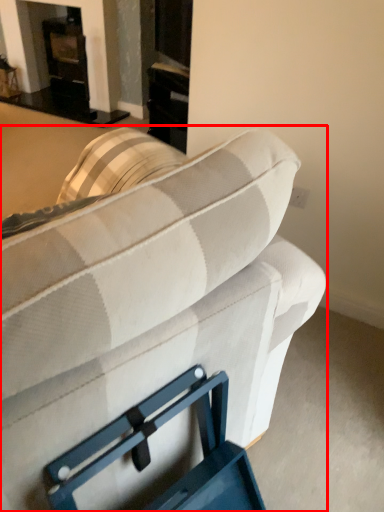
Question: From the image's perspective, where is studio couch (annotated by the red box) located in relation to fireplace in the image?

Choices:
 (A) below
 (B) above

Answer: (A)